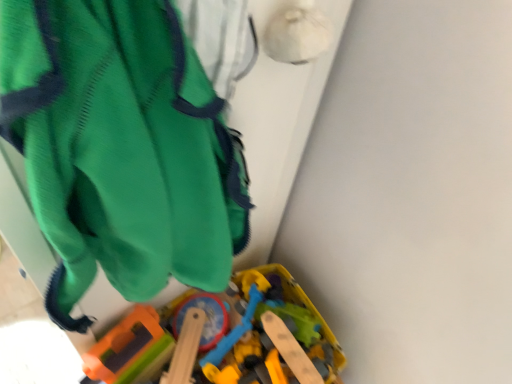
The width and height of the screenshot is (512, 384). I want to click on wooden toy train at lower center, so click(224, 337).

This screenshot has height=384, width=512. What do you see at coordinates (224, 337) in the screenshot? I see `wooden toy train at lower center` at bounding box center [224, 337].

Measure the distance between point (163, 363) and camera.

They are 32.40 inches apart.

Locate an element on the screen. green fabric backpack at upper left is located at coordinates [x=121, y=147].

What do you see at coordinates (121, 147) in the screenshot?
I see `green fabric backpack at upper left` at bounding box center [121, 147].

This screenshot has width=512, height=384. In order to click on wooden toy train at lower center in this screenshot , I will do `click(224, 337)`.

Based on their positions, is wooden toy train at lower center located to the left or right of green fabric backpack at upper left?

Based on their positions, wooden toy train at lower center is located to the right of green fabric backpack at upper left.

Which object is closer to the camera, wooden toy train at lower center or green fabric backpack at upper left?

green fabric backpack at upper left.

Is point (180, 299) farther from viewer compared to point (151, 272)?

Yes, point (180, 299) is farther from viewer.

From the image's perspective, is wooden toy train at lower center on green fabric backpack at upper left?

Incorrect, from the image's perspective, wooden toy train at lower center is lower than green fabric backpack at upper left.

From a real-world perspective, is wooden toy train at lower center above or below green fabric backpack at upper left?

wooden toy train at lower center is situated lower than green fabric backpack at upper left in the real world.

Can you confirm if wooden toy train at lower center is thinner than green fabric backpack at upper left?

In fact, wooden toy train at lower center might be wider than green fabric backpack at upper left.

Is wooden toy train at lower center taller than green fabric backpack at upper left?

No.

Considering the relative sizes of wooden toy train at lower center and green fabric backpack at upper left in the image provided, is wooden toy train at lower center bigger than green fabric backpack at upper left?

Yes, wooden toy train at lower center is bigger than green fabric backpack at upper left.

Is wooden toy train at lower center inside or outside of green fabric backpack at upper left?

The correct answer is: outside.

Is wooden toy train at lower center far away from green fabric backpack at upper left?

wooden toy train at lower center is near green fabric backpack at upper left, not far away.

Is wooden toy train at lower center looking in the opposite direction of green fabric backpack at upper left?

wooden toy train at lower center is not turned away from green fabric backpack at upper left.

How many degrees apart are the facing directions of wooden toy train at lower center and green fabric backpack at upper left?

The angle between the facing direction of wooden toy train at lower center and the facing direction of green fabric backpack at upper left is 90 degrees.

Identify the location of wide above the wooden toy train at lower center (from a real-world perspective). (121, 147).

Considering the positions of objects green fabric backpack at upper left and wooden toy train at lower center in the image provided, who is more to the right, green fabric backpack at upper left or wooden toy train at lower center?

wooden toy train at lower center.

Looking at this image, considering the positions of objects green fabric backpack at upper left and wooden toy train at lower center in the image provided, who is behind, green fabric backpack at upper left or wooden toy train at lower center?

wooden toy train at lower center.

Considering the points (106, 134) and (155, 374), which point is in front, point (106, 134) or point (155, 374)?

The point (106, 134) is closer to the camera.

From the image's perspective, which one is positioned higher, green fabric backpack at upper left or wooden toy train at lower center?

green fabric backpack at upper left appears higher in the image.

From a real-world perspective, is green fabric backpack at upper left positioned over wooden toy train at lower center based on gravity?

Indeed, from a real-world perspective, green fabric backpack at upper left stands above wooden toy train at lower center.

Considering the sizes of green fabric backpack at upper left and wooden toy train at lower center in the image, is green fabric backpack at upper left wider or thinner than wooden toy train at lower center?

green fabric backpack at upper left is thinner than wooden toy train at lower center.

Between green fabric backpack at upper left and wooden toy train at lower center, which one has more height?

Standing taller between the two is green fabric backpack at upper left.

Considering the relative sizes of green fabric backpack at upper left and wooden toy train at lower center in the image provided, is green fabric backpack at upper left smaller than wooden toy train at lower center?

Yes.

Does green fabric backpack at upper left contain wooden toy train at lower center?

No, wooden toy train at lower center is not surrounded by green fabric backpack at upper left.

Is the surface of green fabric backpack at upper left in direct contact with wooden toy train at lower center?

green fabric backpack at upper left and wooden toy train at lower center are not in contact.

Is green fabric backpack at upper left positioned with its back to wooden toy train at lower center?

No.

Locate an element on the screen. The width and height of the screenshot is (512, 384). wide on the left of wooden toy train at lower center is located at coordinates (121, 147).

Where is `toy below the green fabric backpack at upper left (from the image's perspective)`? Image resolution: width=512 pixels, height=384 pixels. toy below the green fabric backpack at upper left (from the image's perspective) is located at coordinates (224, 337).

Find the location of a particular element. wide above the wooden toy train at lower center (from the image's perspective) is located at coordinates (121, 147).